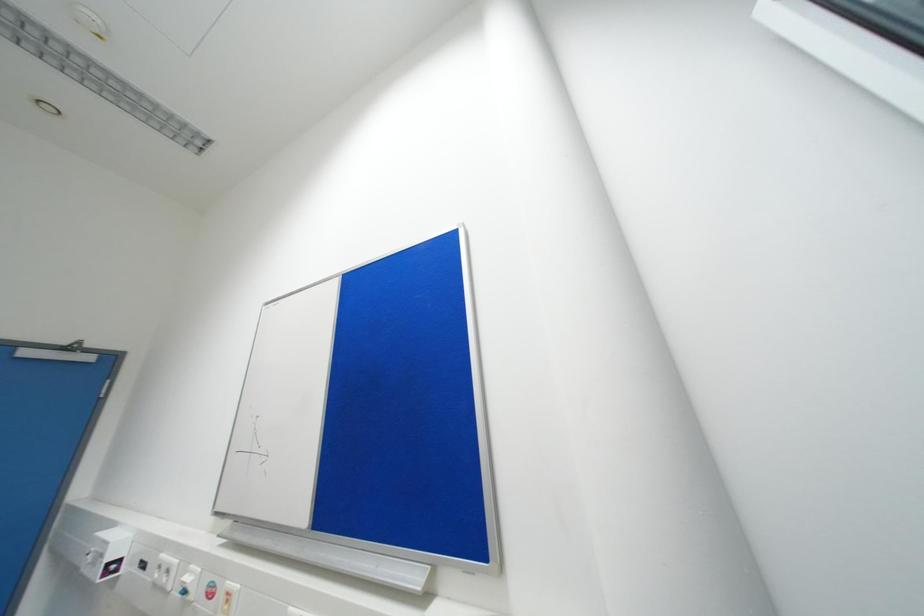
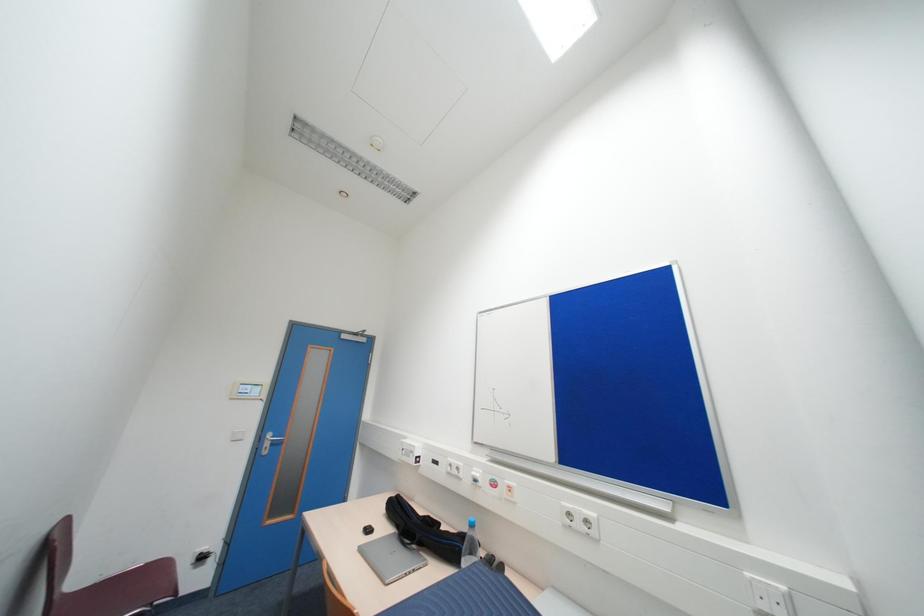
Based on the photo, which direction would the cameraman need to move to produce the second image?

The movement direction of the cameraman is left, backward.